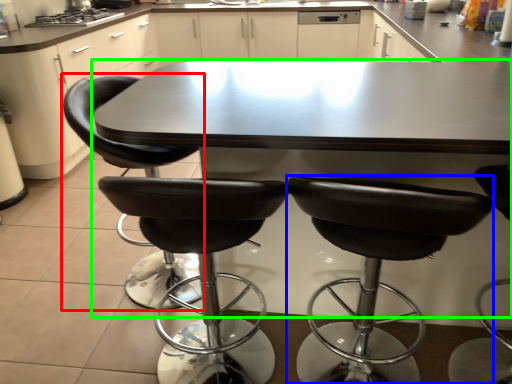
Question: Estimate the real-world distances between objects in this image. Which object is farther from chair (highlighted by a red box), chair (highlighted by a blue box) or table (highlighted by a green box)?

Choices:
 (A) chair
 (B) table

Answer: (A)